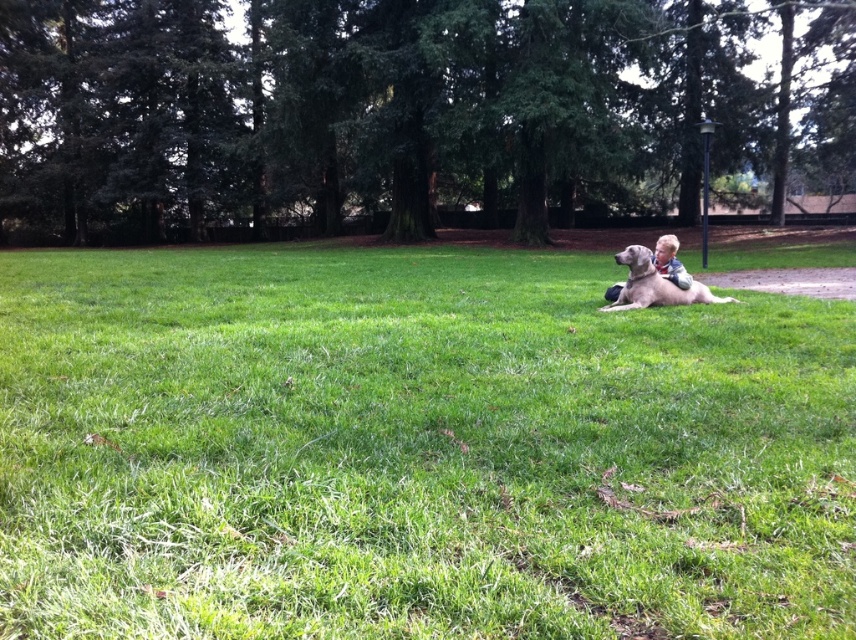
Is point (318, 349) closer to camera compared to point (646, 300)?

Yes, point (318, 349) is in front of point (646, 300).

Who is higher up, green grassy field at center or light brown fur at center?

light brown fur at center is above.

Does point (135, 332) come closer to viewer compared to point (629, 301)?

Yes, point (135, 332) is closer to viewer.

Where is `green grassy field at center`? This screenshot has height=640, width=856. green grassy field at center is located at coordinates (414, 449).